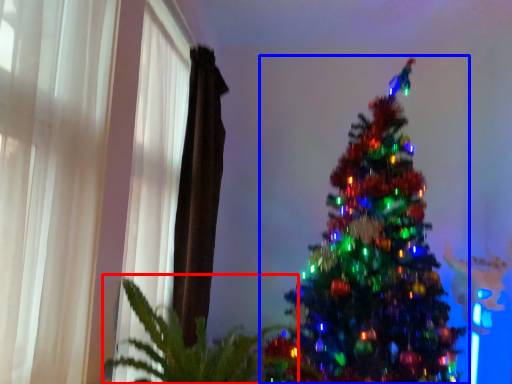
Question: Which object is further to the camera taking this photo, plant (highlighted by a red box) or christmas tree (highlighted by a blue box)?

Choices:
 (A) plant
 (B) christmas tree

Answer: (B)